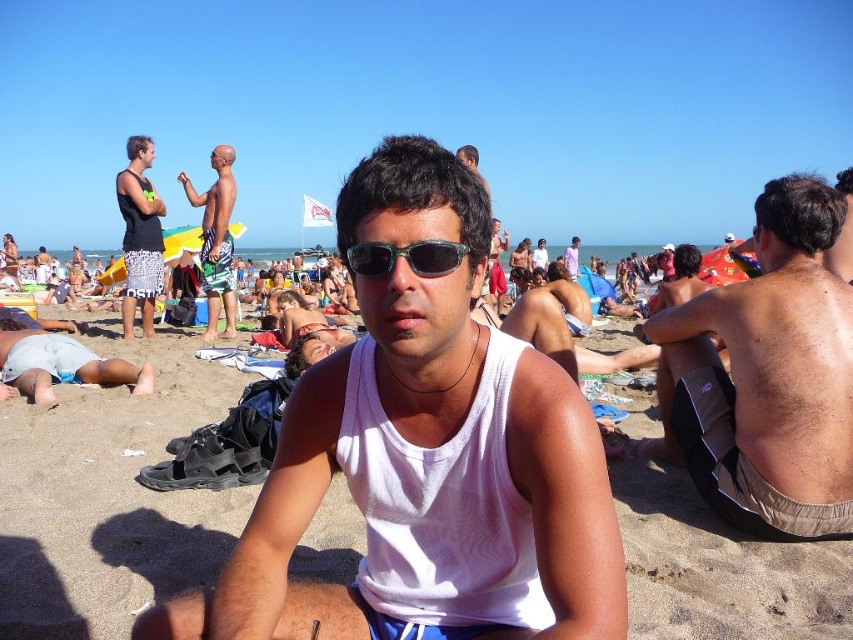
You are a photographer trying to capture the man in the scene. You notice the white matte tank top at center and the matte black sunglasses at upper center. Which object is shorter in height?

The white matte tank top at center is shorter in height compared to the matte black sunglasses at upper center.